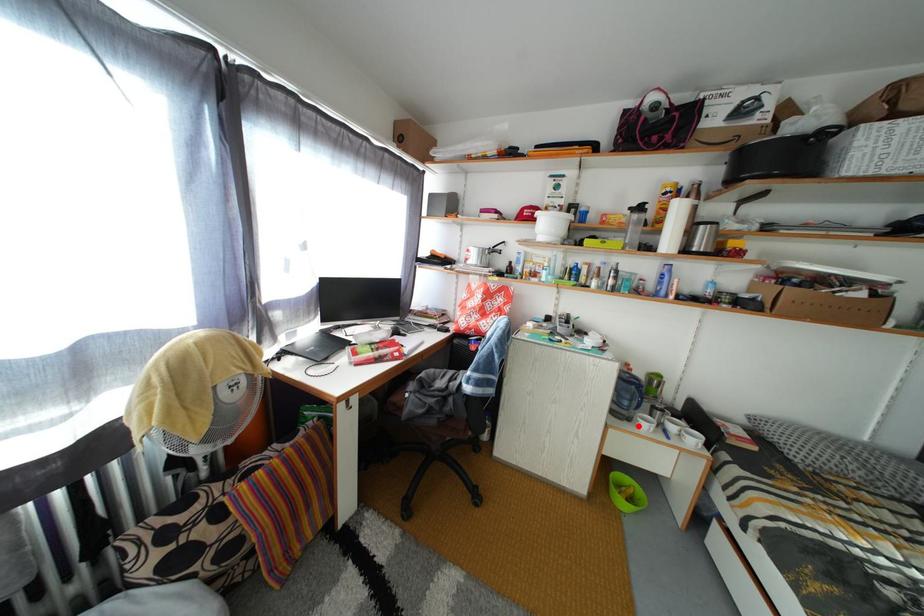
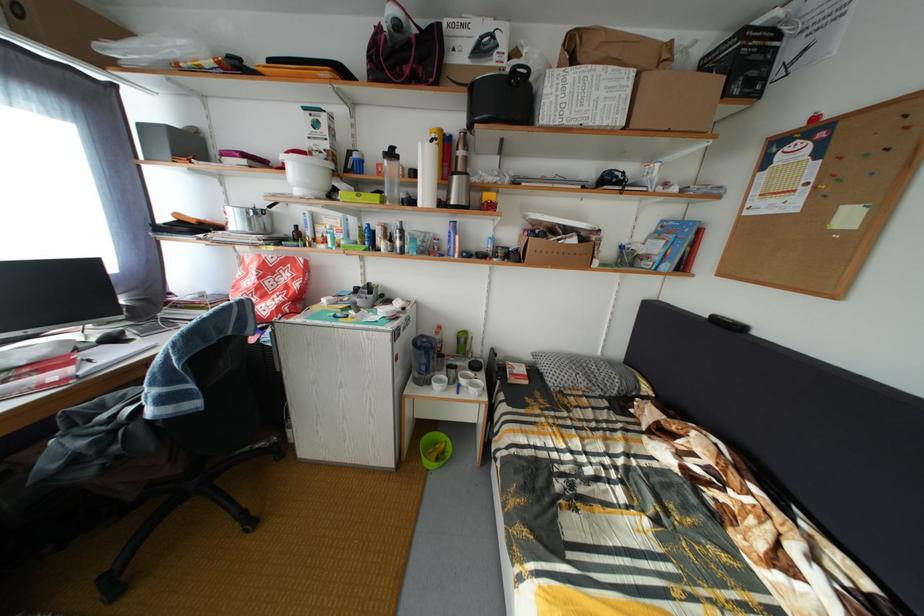
Locate, in the second image, the point that corresponds to the highlighted location in the first image.

(438, 390)